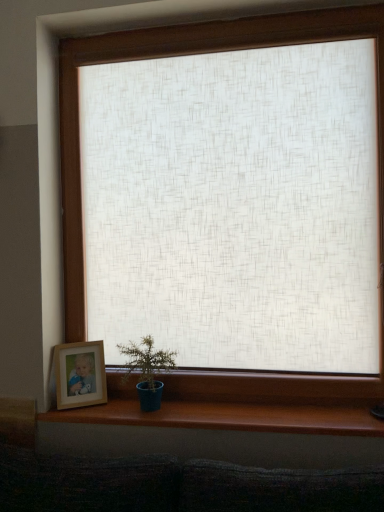
You are a GUI agent. You are given a task and a screenshot of the screen. Output one action in this format:
    pyautogui.click(x=<x>, y=<y>)
    Task: Click on the vacant region above brown wood at lower center (from a real-world perspective)
    
    Given the screenshot: What is the action you would take?
    pyautogui.click(x=206, y=407)